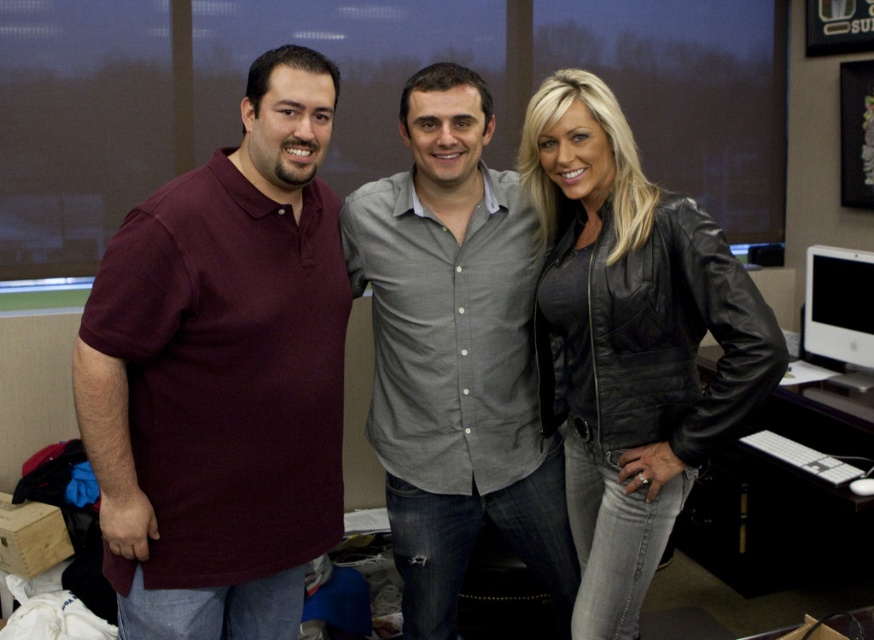
Is maroon polo shirt at left taller than black leather jacket at center?

In fact, maroon polo shirt at left may be shorter than black leather jacket at center.

Find the location of a particular element. maroon polo shirt at left is located at coordinates (222, 376).

Looking at this image, who is shorter, maroon polo shirt at left or white glossy monitor at right?

With less height is white glossy monitor at right.

Is maroon polo shirt at left smaller than white glossy monitor at right?

No, maroon polo shirt at left is not smaller than white glossy monitor at right.

The image size is (874, 640). I want to click on maroon polo shirt at left, so click(222, 376).

Is black leather jacket at center closer to camera compared to gray button-up shirt at center?

Yes, it is.

Does black leather jacket at center have a greater width compared to gray button-up shirt at center?

No.

From the picture: Who is more distant from viewer, (595, 547) or (418, 278)?

The point (418, 278) is behind.

What are the coordinates of `black leather jacket at center` in the screenshot? It's located at (630, 340).